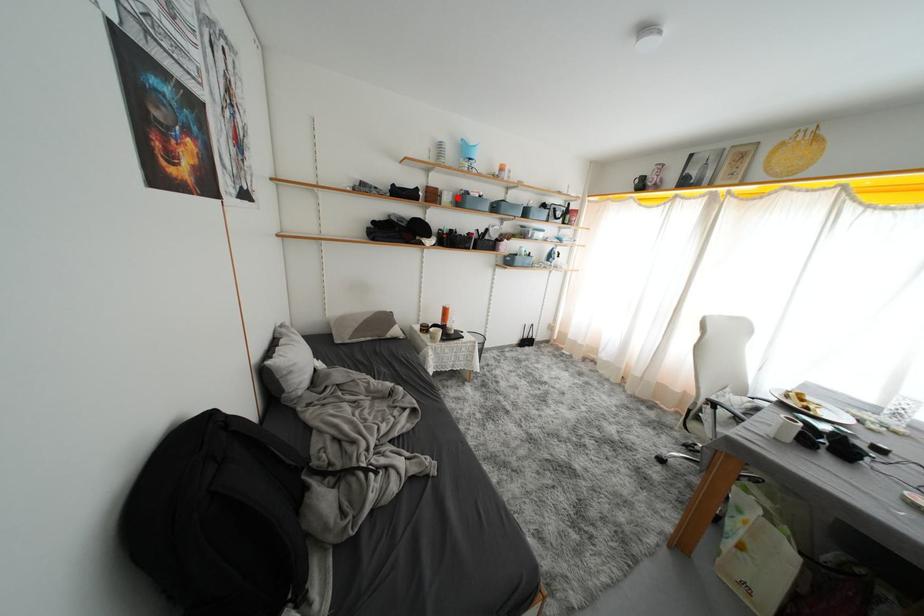
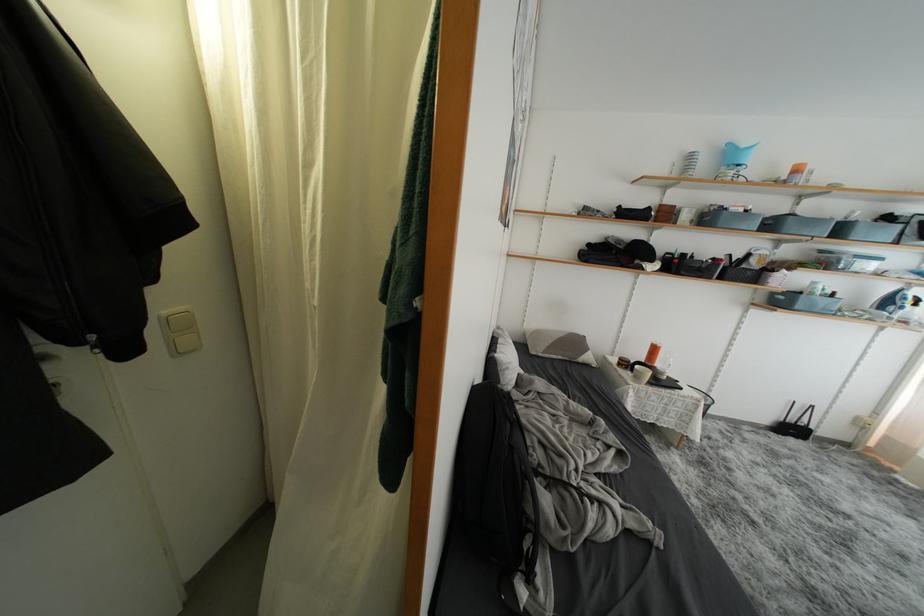
Locate, in the second image, the point that corresponds to the highlighted location in the first image.

(700, 215)